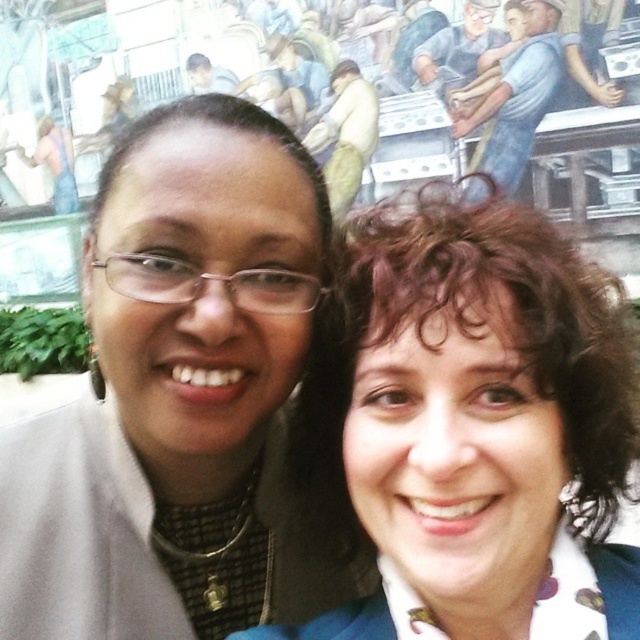
You are taking a photo of the two people in the scene. The matte black jacket at left and the blue fabric shirt at upper right are both in the frame. Which object is positioned lower in the image?

The matte black jacket at left is located below the blue fabric shirt at upper right, so it is positioned lower in the image.

From the picture: You are taking a photo of the two people in the scene. The curly brown hair at center is blocking the blue fabric shirt at upper right. How can you adjust the camera angle to ensure both are visible?

Since the curly brown hair at center is in front of the blue fabric shirt at upper right, you can move the camera angle slightly to the left or right to capture both subjects without obstruction.